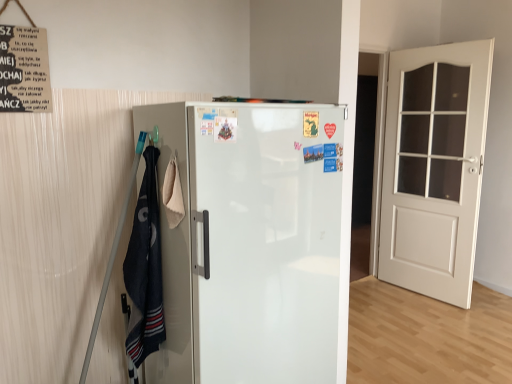
Question: Can you confirm if white wood door at right is shorter than dark blue cotton towel at left?

Choices:
 (A) no
 (B) yes

Answer: (A)

Question: From the image's perspective, does white wood door at right appear lower than dark blue cotton towel at left?

Choices:
 (A) yes
 (B) no

Answer: (B)

Question: Does white wood door at right lie in front of dark blue cotton towel at left?

Choices:
 (A) no
 (B) yes

Answer: (A)

Question: Is white wood door at right thinner than dark blue cotton towel at left?

Choices:
 (A) no
 (B) yes

Answer: (B)

Question: Is white wood door at right touching dark blue cotton towel at left?

Choices:
 (A) no
 (B) yes

Answer: (A)

Question: Can you confirm if white wood door at right is wider than dark blue cotton towel at left?

Choices:
 (A) yes
 (B) no

Answer: (B)

Question: Would you say white wood door at right is outside white glossy refrigerator at center?

Choices:
 (A) yes
 (B) no

Answer: (A)

Question: Is white wood door at right at the right side of white glossy refrigerator at center?

Choices:
 (A) yes
 (B) no

Answer: (A)

Question: From a real-world perspective, is white wood door at right on white glossy refrigerator at center?

Choices:
 (A) no
 (B) yes

Answer: (B)

Question: Is white wood door at right wider than white glossy refrigerator at center?

Choices:
 (A) yes
 (B) no

Answer: (B)

Question: Is there a large distance between white wood door at right and white glossy refrigerator at center?

Choices:
 (A) no
 (B) yes

Answer: (B)

Question: From a real-world perspective, is white wood door at right positioned under white glossy refrigerator at center based on gravity?

Choices:
 (A) yes
 (B) no

Answer: (B)

Question: Is white glossy refrigerator at center aimed at white wood door at right?

Choices:
 (A) no
 (B) yes

Answer: (A)